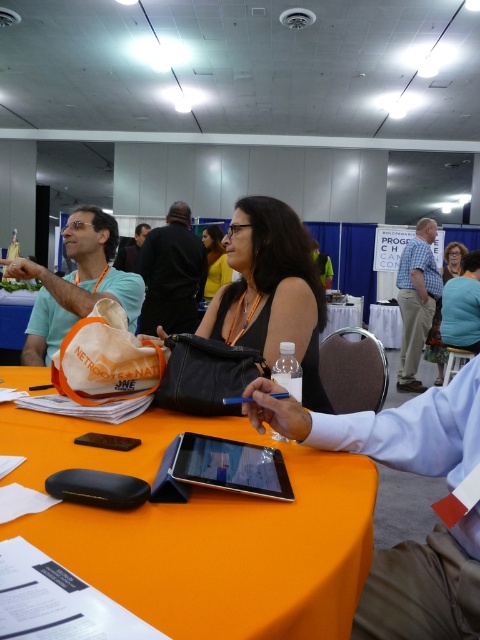
Question: Can you confirm if black fabric jacket at center is positioned above black glossy tablet at center?

Choices:
 (A) no
 (B) yes

Answer: (B)

Question: Is checkered fabric shirt at upper right further to the viewer compared to matte teal tank top at center?

Choices:
 (A) yes
 (B) no

Answer: (A)

Question: Can you confirm if black fabric jacket at center is positioned to the right of matte black tank top at center?

Choices:
 (A) yes
 (B) no

Answer: (B)

Question: Estimate the real-world distances between objects in this image. Which object is farther from the matte teal tank top at center?

Choices:
 (A) black fabric purse at center
 (B) checkered fabric shirt at upper right

Answer: (A)

Question: Which object is positioned farthest from the checkered fabric shirt at upper right?

Choices:
 (A) black fabric jacket at center
 (B) black fabric shirt at upper center
 (C) matte black tank top at center
 (D) matte teal tank top at center

Answer: (B)

Question: Which object is farther from the camera taking this photo?

Choices:
 (A) orange fabric table at center
 (B) matte light blue shirt at upper left

Answer: (B)